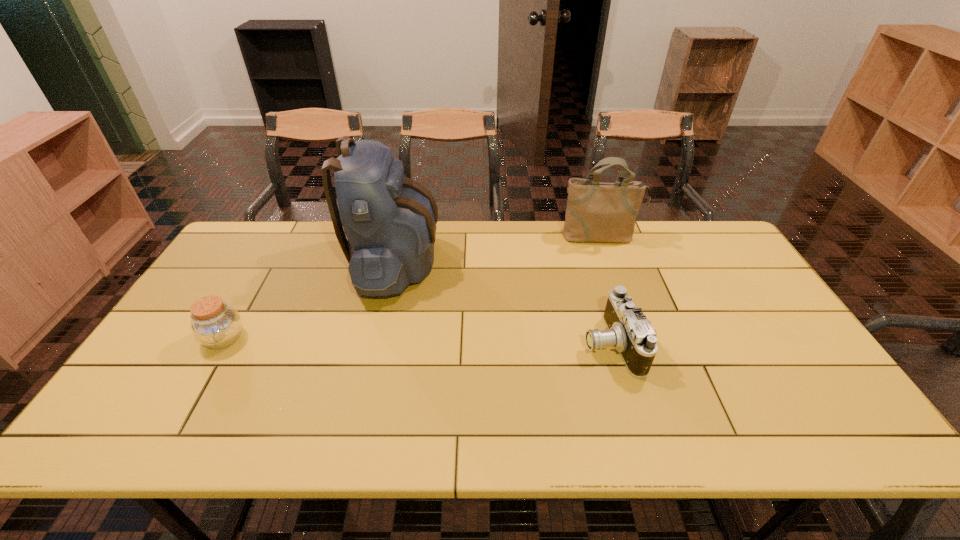
Locate an element on the screen. free space between the second tallest object and the leftmost object is located at coordinates (413, 288).

The width and height of the screenshot is (960, 540). I want to click on vacant area that lies between the tallest object and the third shortest object, so click(498, 249).

Find the location of a particular element. The width and height of the screenshot is (960, 540). empty space that is in between the second tallest object and the camera is located at coordinates (606, 291).

The width and height of the screenshot is (960, 540). Find the location of `vacant space that is in between the third shortest object and the jar`. vacant space that is in between the third shortest object and the jar is located at coordinates (413, 288).

The image size is (960, 540). In order to click on free area in between the third shortest object and the tallest object in this screenshot , I will do `click(498, 249)`.

Find the location of `free space between the second object from left to right and the leftmost object`. free space between the second object from left to right and the leftmost object is located at coordinates (310, 300).

I want to click on free space between the camera and the leftmost object, so click(x=418, y=341).

This screenshot has height=540, width=960. I want to click on free space between the backpack and the shoulder bag, so click(x=498, y=249).

The height and width of the screenshot is (540, 960). Find the location of `free space between the tallest object and the camera`. free space between the tallest object and the camera is located at coordinates (504, 303).

Select which object is the closest to the backpack. Please provide its 2D coordinates. Your answer should be formatted as a tuple, i.e. [(x, y)], where the tuple contains the x and y coordinates of a point satisfying the conditions above.

[(215, 324)]